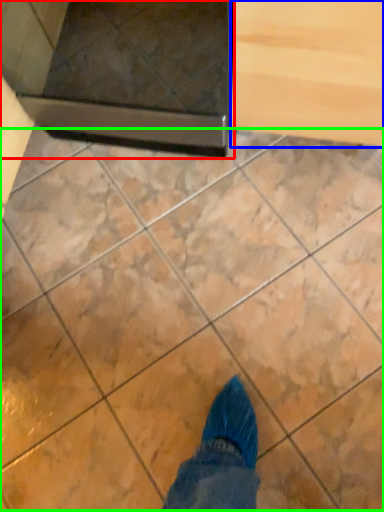
Question: Which is nearer to the appliance (highlighted by a red box)? drawer (highlighted by a blue box) or marble (highlighted by a green box).

Choices:
 (A) drawer
 (B) marble

Answer: (A)